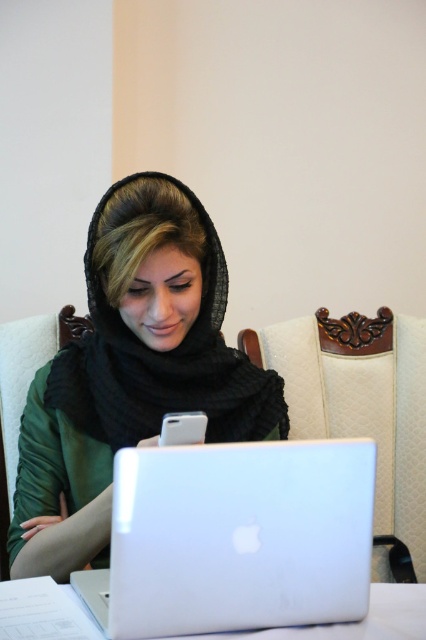
Looking at this image, can you confirm if silver metallic laptop at center is wider than white matte smartphone at center?

Correct, the width of silver metallic laptop at center exceeds that of white matte smartphone at center.

Is silver metallic laptop at center in front of white matte smartphone at center?

Yes, silver metallic laptop at center is in front of white matte smartphone at center.

You are a GUI agent. You are given a task and a screenshot of the screen. Output one action in this format:
    pyautogui.click(x=<x>, y=<y>)
    Task: Click on the silver metallic laptop at center
    The height and width of the screenshot is (640, 426).
    Given the screenshot: What is the action you would take?
    pyautogui.click(x=236, y=538)

Is matte black hijab at center wider than white glossy table at lower center?

No.

At what (x,y) coordinates should I click in order to perform the action: click on matte black hijab at center. Please return your answer as a coordinate pair (x, y). The width and height of the screenshot is (426, 640). Looking at the image, I should click on (132, 369).

Who is positioned more to the left, white glossy table at lower center or white matte smartphone at center?

From the viewer's perspective, white matte smartphone at center appears more on the left side.

Is point (420, 611) in front of point (187, 422)?

No, it is not.

At what (x,y) coordinates should I click in order to perform the action: click on white glossy table at lower center. Please return your answer as a coordinate pair (x, y). The width and height of the screenshot is (426, 640). Looking at the image, I should click on click(43, 611).